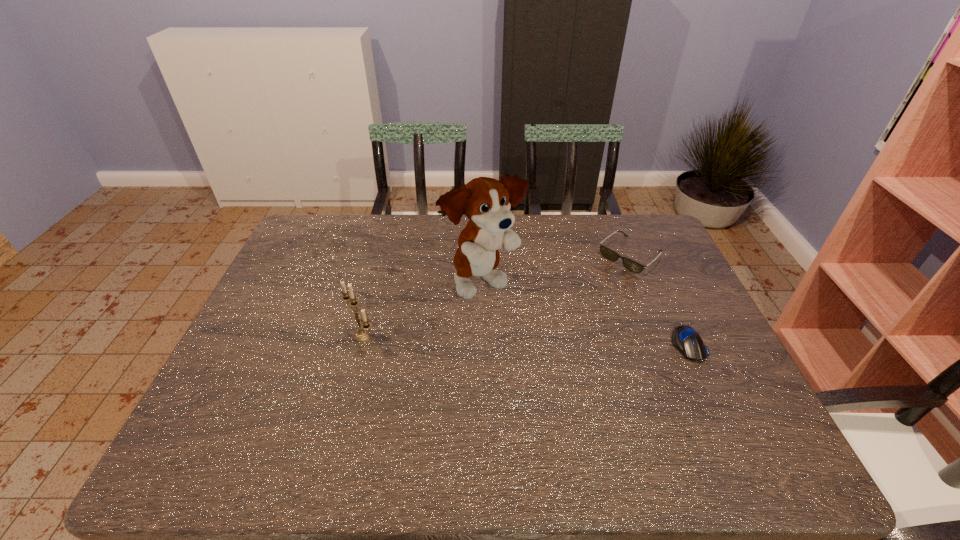
You are a GUI agent. You are given a task and a screenshot of the screen. Output one action in this format:
    pyautogui.click(x=<x>, y=<y>)
    Task: Click on the empty location between the computer mouse and the third shortest object
    
    Given the screenshot: What is the action you would take?
    525,340

Locate an element on the screen. free point between the puppy and the second shortest object is located at coordinates (557, 269).

Locate which object is the third closest to the sunglasses. Please provide its 2D coordinates. Your answer should be formatted as a tuple, i.e. [(x, y)], where the tuple contains the x and y coordinates of a point satisfying the conditions above.

[(362, 334)]

Identify which object is the third nearest to the puppy. Please provide its 2D coordinates. Your answer should be formatted as a tuple, i.e. [(x, y)], where the tuple contains the x and y coordinates of a point satisfying the conditions above.

[(685, 339)]

Where is `blank space that satisfies the following two spatial constraints: 1. on the back side of the second tallest object; 2. on the right side of the second object from left to right`? blank space that satisfies the following two spatial constraints: 1. on the back side of the second tallest object; 2. on the right side of the second object from left to right is located at coordinates (376, 283).